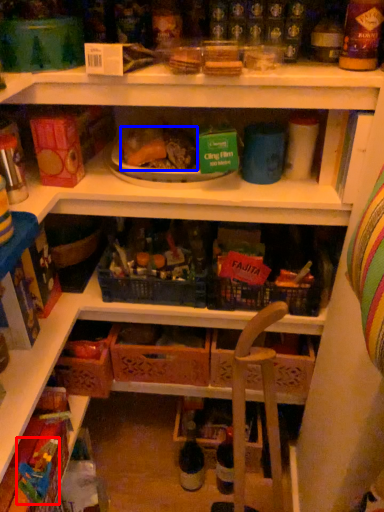
Question: Among these objects, which one is nearest to the camera, toy (highlighted by a red box) or food (highlighted by a blue box)?

Choices:
 (A) toy
 (B) food

Answer: (A)